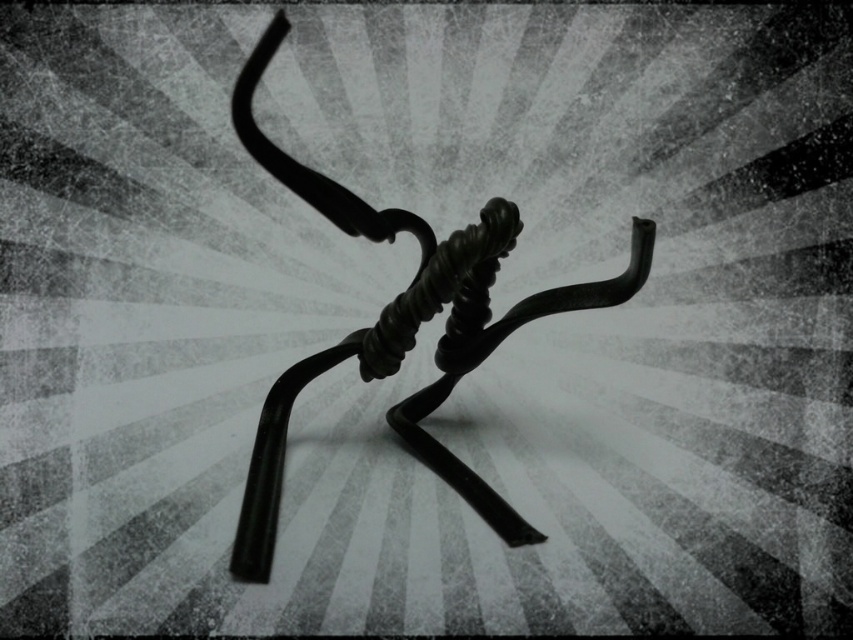
You are an art curator examining the black matte wire sculpture at center and the black rubber knot at center in the image. Which object takes up more visual space in the composition?

The black matte wire sculpture at center is larger in size than the black rubber knot at center, so it occupies more visual space in the composition.

You are an art curator examining the black matte wire sculpture at center and the black rubber knot at center in the image. Which object is positioned higher in the scene?

The black matte wire sculpture at center is positioned higher than the black rubber knot at center.